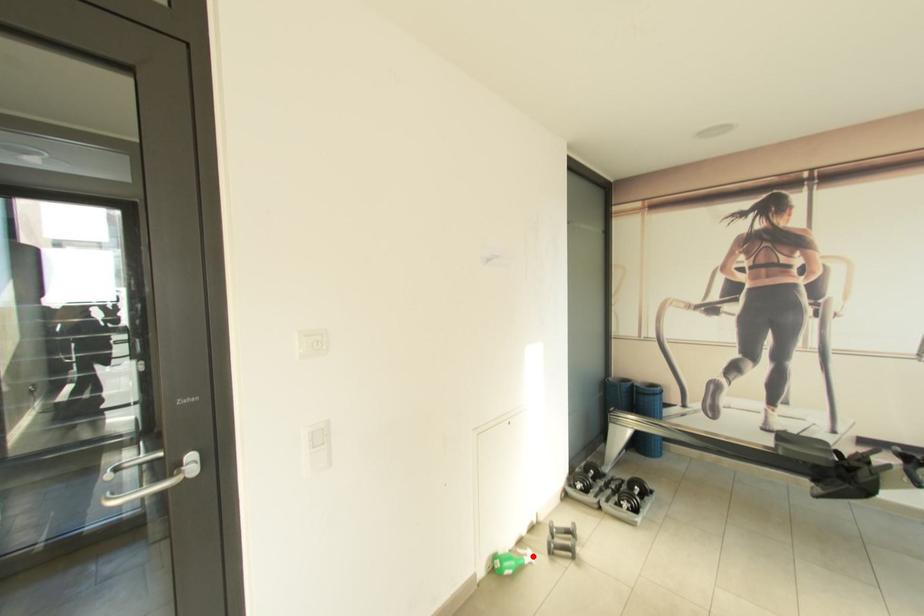
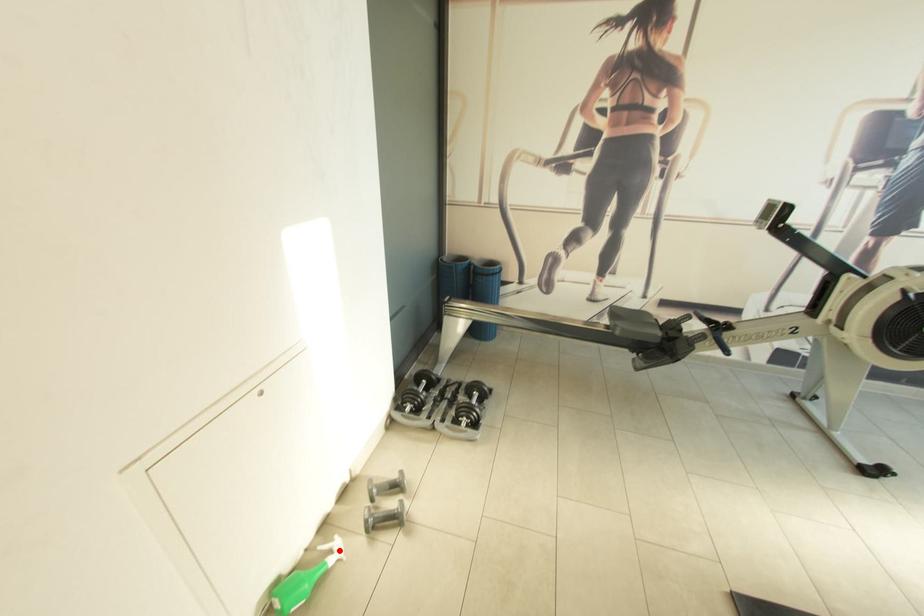
I am providing you with two images of the same scene from different viewpoints. A red point is marked on the first image and another point is marked on the second image. Is the marked point in image1 the same physical position as the marked point in image2?

Yes